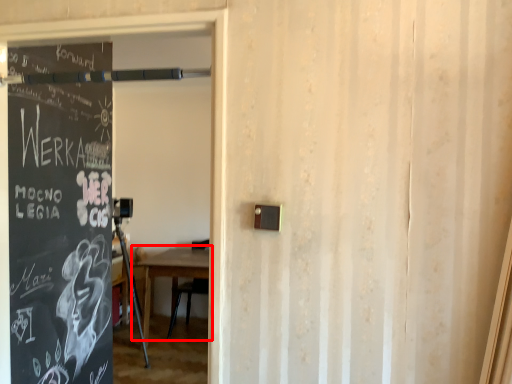
Question: From the image's perspective, what is the correct spatial positioning of table (annotated by the red box) in reference to garage door?

Choices:
 (A) above
 (B) below

Answer: (B)